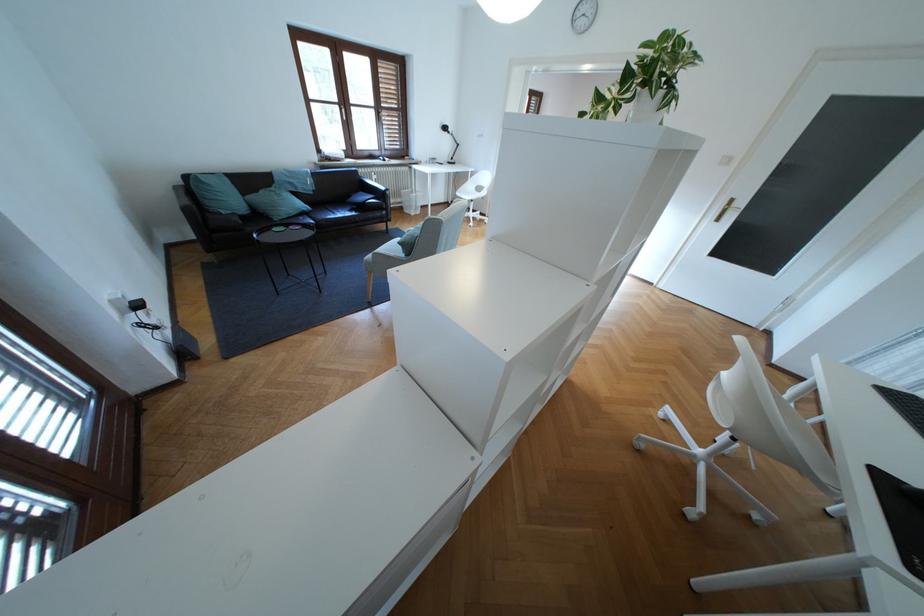
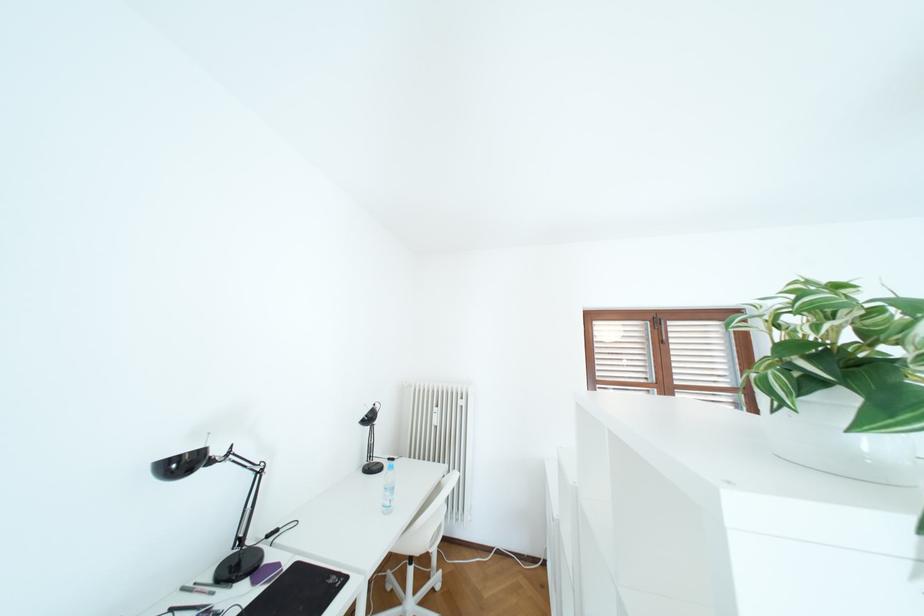
The point at (660, 68) is marked in the first image. Where is the corresponding point in the second image?

(811, 339)